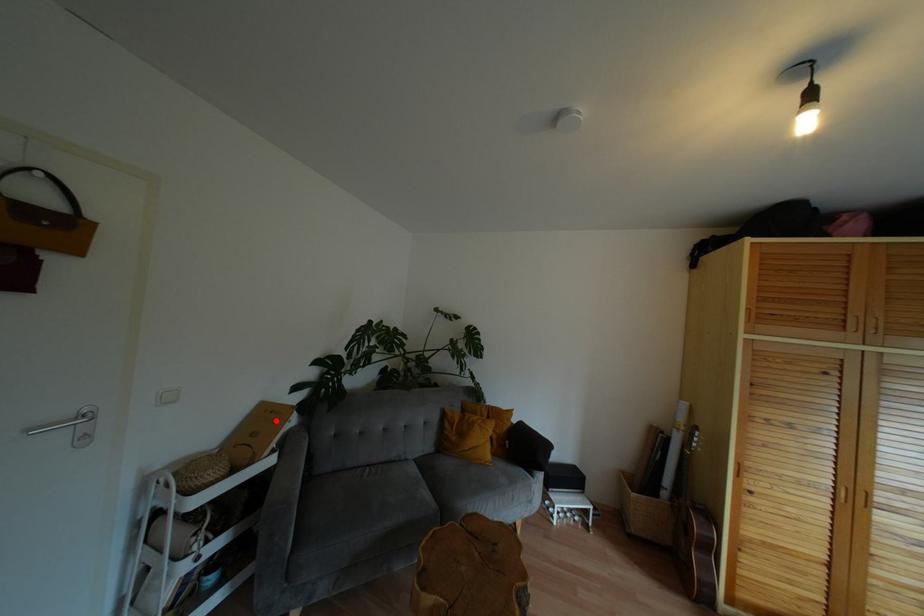
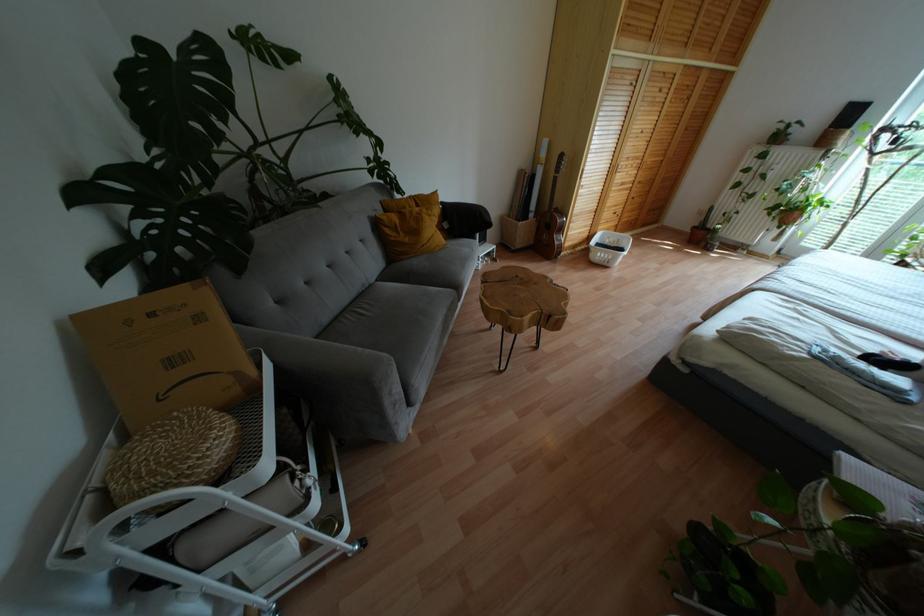
Locate, in the second image, the point that corresponds to the highlighted location in the first image.

(199, 317)